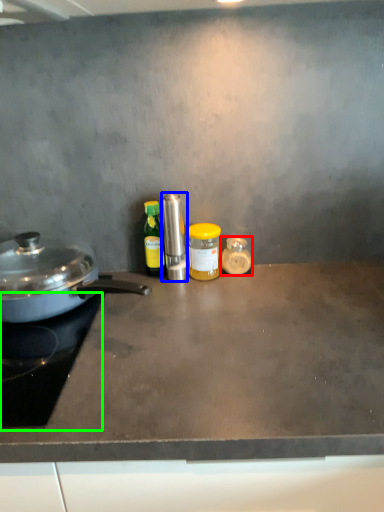
Question: Which is farther away from kitchen appliance (highlighted by a red box)? kitchen appliance (highlighted by a blue box) or gas stove (highlighted by a green box)?

Choices:
 (A) kitchen appliance
 (B) gas stove

Answer: (B)